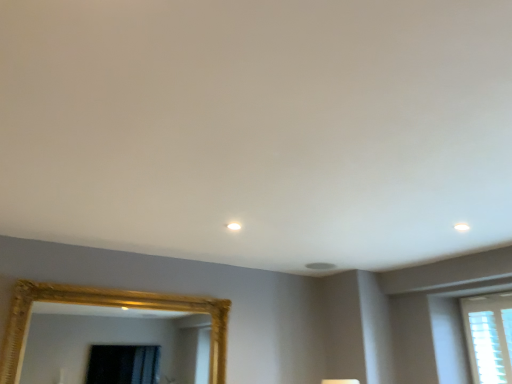
Question: Is white textured blinds at right behind gold textured mirror at lower left?

Choices:
 (A) no
 (B) yes

Answer: (B)

Question: Is white textured blinds at right taller than gold textured mirror at lower left?

Choices:
 (A) no
 (B) yes

Answer: (B)

Question: Is white textured blinds at right next to gold textured mirror at lower left?

Choices:
 (A) no
 (B) yes

Answer: (A)

Question: Can you confirm if white textured blinds at right is wider than gold textured mirror at lower left?

Choices:
 (A) yes
 (B) no

Answer: (B)

Question: Is gold textured mirror at lower left a part of white textured blinds at right?

Choices:
 (A) no
 (B) yes

Answer: (A)

Question: From the image's perspective, is white textured blinds at right on gold textured mirror at lower left?

Choices:
 (A) no
 (B) yes

Answer: (A)

Question: Is gold textured mirror at lower left beside white textured blinds at right?

Choices:
 (A) no
 (B) yes

Answer: (A)

Question: Is gold textured mirror at lower left positioned behind white textured blinds at right?

Choices:
 (A) no
 (B) yes

Answer: (A)

Question: Is gold textured mirror at lower left at the right side of white textured blinds at right?

Choices:
 (A) yes
 (B) no

Answer: (B)

Question: Is gold textured mirror at lower left thinner than white textured blinds at right?

Choices:
 (A) yes
 (B) no

Answer: (B)

Question: From a real-world perspective, is gold textured mirror at lower left under white textured blinds at right?

Choices:
 (A) yes
 (B) no

Answer: (A)

Question: Is gold textured mirror at lower left positioned beyond the bounds of white textured blinds at right?

Choices:
 (A) yes
 (B) no

Answer: (A)

Question: Considering the positions of point (480, 370) and point (145, 337), is point (480, 370) closer or farther from the camera than point (145, 337)?

Choices:
 (A) closer
 (B) farther

Answer: (A)